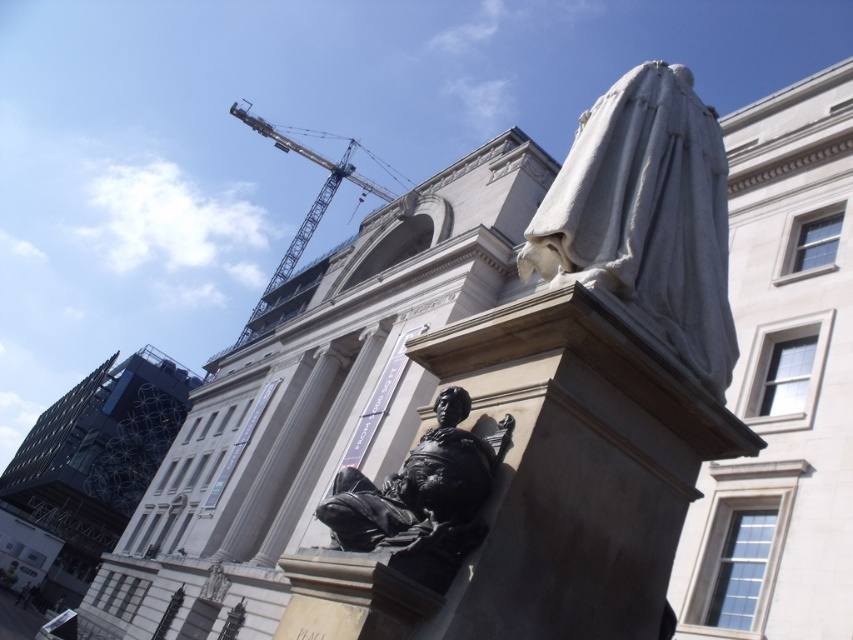
Describe the element at coordinates (646, 216) in the screenshot. I see `white marble statue at upper right` at that location.

Does white marble statue at upper right appear under black polished statue at lower center?

No, white marble statue at upper right is not below black polished statue at lower center.

Who is more forward, (712, 212) or (428, 486)?

Point (428, 486) is more forward.

At what (x,y) coordinates should I click in order to perform the action: click on white marble statue at upper right. Please return your answer as a coordinate pair (x, y). Looking at the image, I should click on (646, 216).

Is black polished statue at lower center to the left of yellow metallic crane at upper center from the viewer's perspective?

No, black polished statue at lower center is not to the left of yellow metallic crane at upper center.

Is black polished statue at lower center to the right of yellow metallic crane at upper center from the viewer's perspective?

Indeed, black polished statue at lower center is positioned on the right side of yellow metallic crane at upper center.

Locate an element on the screen. The image size is (853, 640). black polished statue at lower center is located at coordinates (422, 499).

Does white marble statue at upper right have a lesser width compared to yellow metallic crane at upper center?

Yes, white marble statue at upper right is thinner than yellow metallic crane at upper center.

Is point (637, 84) closer to camera compared to point (341, 164)?

Yes, it is.

Which is in front, point (550, 240) or point (285, 256)?

Positioned in front is point (550, 240).

The width and height of the screenshot is (853, 640). Identify the location of white marble statue at upper right. (646, 216).